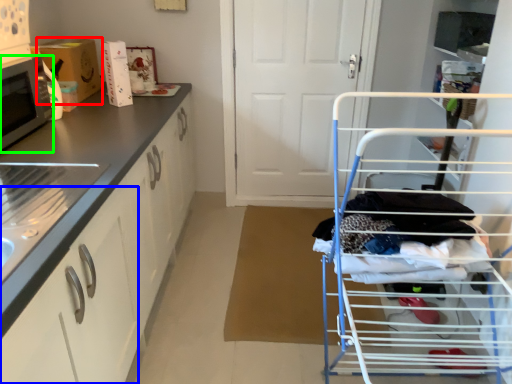
Question: Which is farther away from cardboard box (highlighted by a red box)? drawer (highlighted by a blue box) or microwave oven (highlighted by a green box)?

Choices:
 (A) drawer
 (B) microwave oven

Answer: (A)